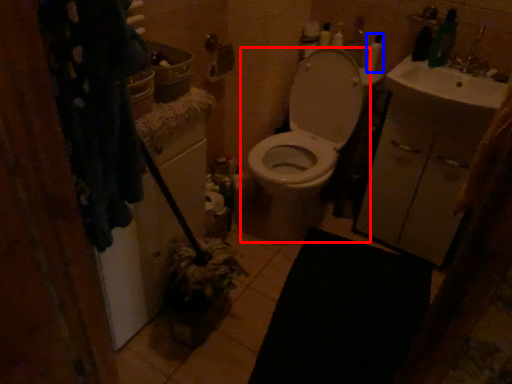
Question: Which of the following is the closest to the observer, toilet (highlighted by a red box) or toiletry (highlighted by a blue box)?

Choices:
 (A) toilet
 (B) toiletry

Answer: (A)